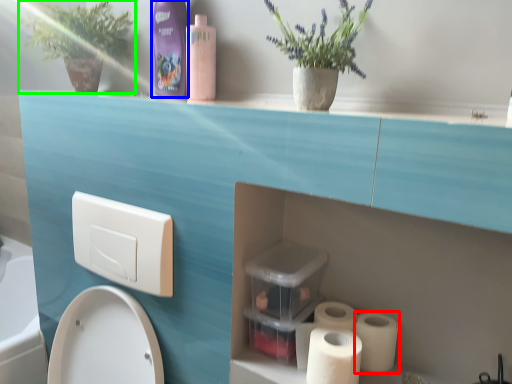
Question: Which is farther away from toilet paper (highlighted by a red box)? cleaning product (highlighted by a blue box) or plant (highlighted by a green box)?

Choices:
 (A) cleaning product
 (B) plant

Answer: (B)